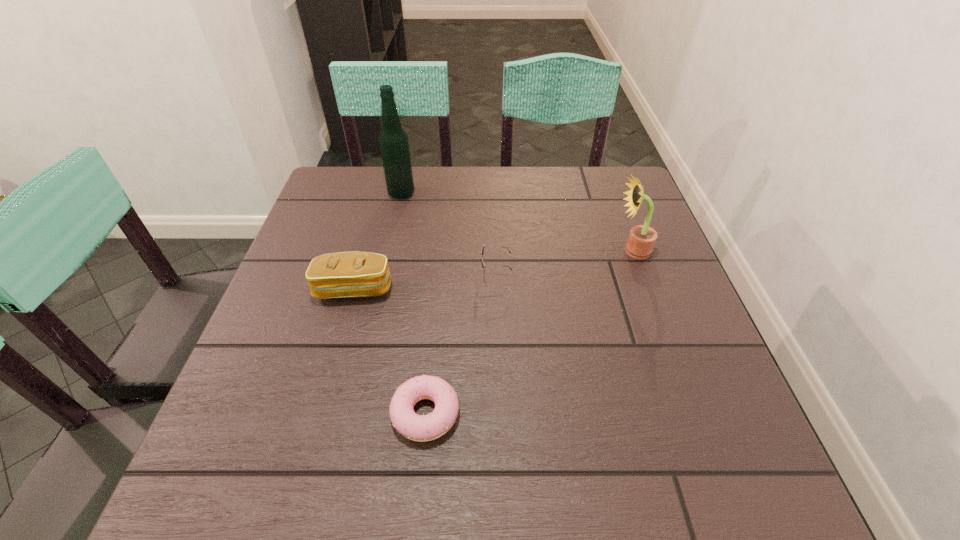
Identify the location of alcohol. (393, 140).

Identify the location of the farthest object. Image resolution: width=960 pixels, height=540 pixels. (393, 140).

Identify the location of the rightmost object. This screenshot has height=540, width=960. (641, 240).

Identify the location of sunflower. (641, 240).

In order to click on clutch bag in this screenshot , I will do `click(344, 274)`.

What are the coordinates of `the fourth object from left to right` in the screenshot? It's located at (x=482, y=250).

At what (x,y) coordinates should I click in order to perform the action: click on doughnut. Please return your answer as a coordinate pair (x, y). The height and width of the screenshot is (540, 960). Looking at the image, I should click on (415, 427).

Locate an element on the screen. the nearest object is located at coordinates (415, 427).

This screenshot has height=540, width=960. What are the coordinates of `vacant space located 0.340m on the front of the farthest object` in the screenshot? It's located at (379, 294).

The image size is (960, 540). I want to click on vacant region located 0.100m on the face of the sunflower, so click(572, 251).